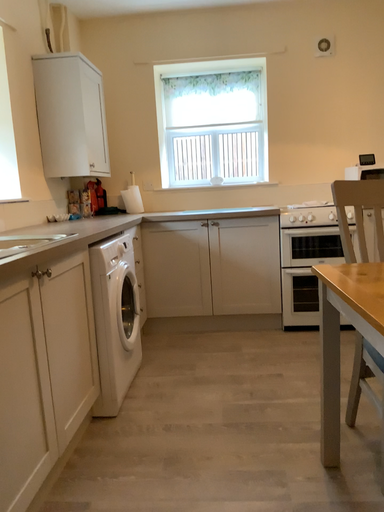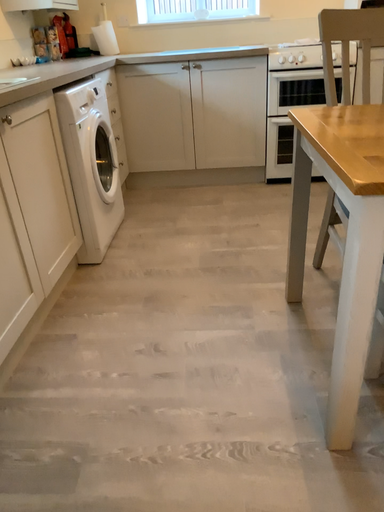
Question: How did the camera likely rotate when shooting the video?

Choices:
 (A) rotated upward
 (B) rotated downward

Answer: (B)